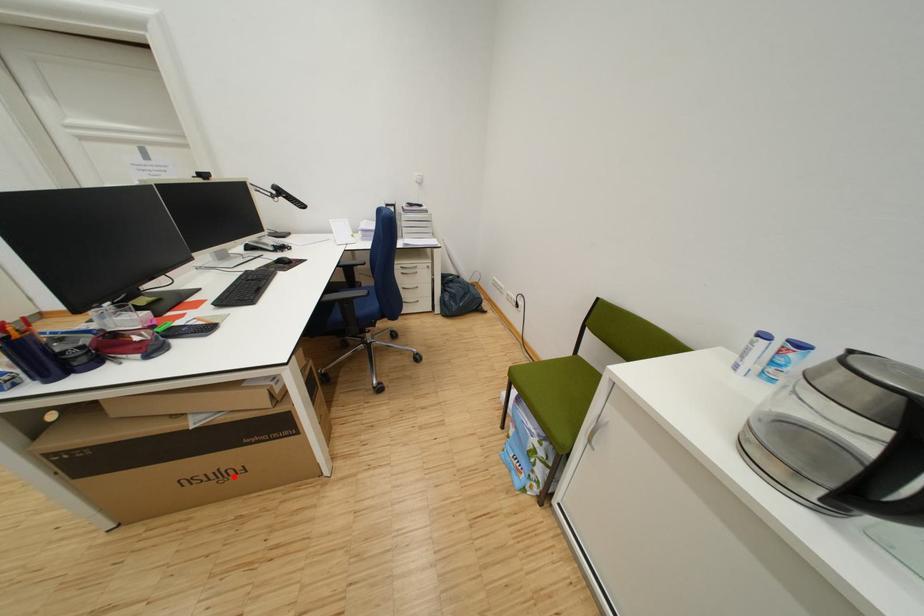
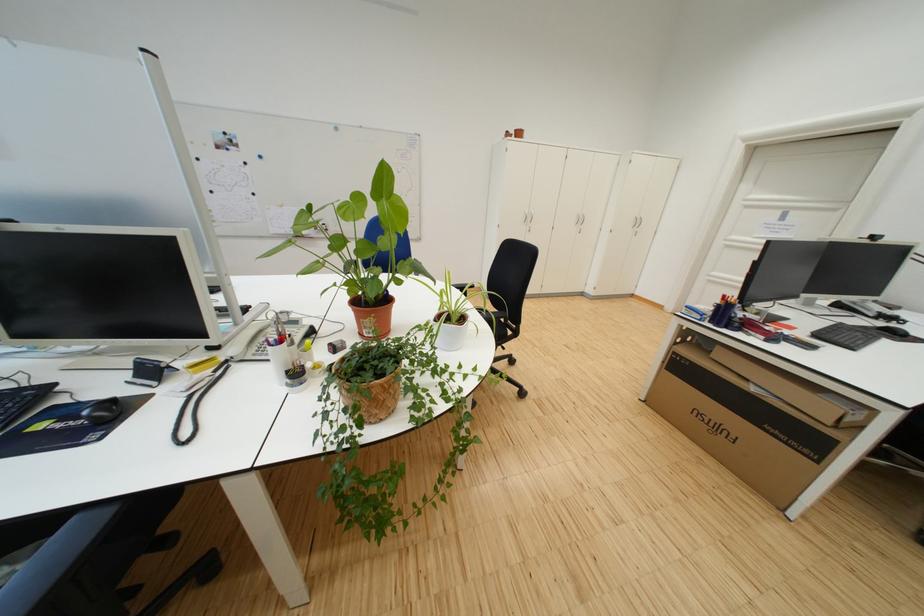
In the second image, find the point that corresponds to the highlighted location in the first image.

(730, 431)